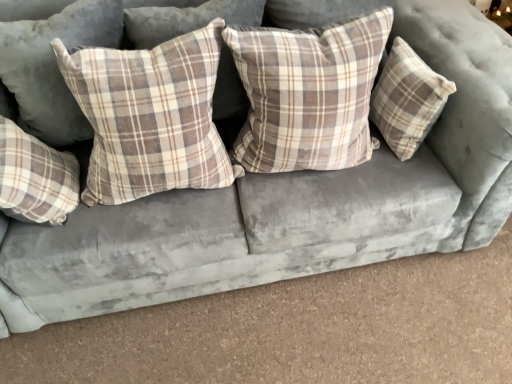
What do you see at coordinates (54, 66) in the screenshot? I see `plaid fabric pillow at upper left, the 1th pillow from the left` at bounding box center [54, 66].

What is the approximate height of plaid fabric pillow at center, the 3th pillow when ordered from left to right?

15.43 inches.

Describe the element at coordinates (35, 178) in the screenshot. This screenshot has height=384, width=512. I see `plaid fabric pillow at left, which is the 2th pillow in left-to-right order` at that location.

Identify the location of plaid fabric pillow at upper left, the 1th pillow from the left. (54, 66).

You are a GUI agent. You are given a task and a screenshot of the screen. Output one action in this format:
    pyautogui.click(x=<x>, y=<y>)
    Task: Click on the pillow that is the 1st one when counting downward from the plaid fabric pillow at center, acting as the 4th pillow starting from the left (from the image's perspective)
    The width and height of the screenshot is (512, 384).
    Given the screenshot: What is the action you would take?
    pyautogui.click(x=150, y=116)

From a real-world perspective, is plaid fabric pillow at center, acting as the 4th pillow starting from the left, above or below plaid fabric pillow at center, which is the 3th pillow from right to left?

In terms of real-world spatial position, plaid fabric pillow at center, acting as the 4th pillow starting from the left, is above plaid fabric pillow at center, which is the 3th pillow from right to left.

Consider the image. Is plaid fabric pillow at center, acting as the 4th pillow starting from the left, positioned with its back to plaid fabric pillow at center, the 3th pillow when ordered from left to right?

No, plaid fabric pillow at center, acting as the 4th pillow starting from the left, is not facing away from plaid fabric pillow at center, the 3th pillow when ordered from left to right.

Is plaid fabric pillow at center, arranged as the 2th pillow when viewed from the right, located outside plaid fabric pillow at center, which is the 3th pillow from right to left?

Yes.

Which point is more forward, (x=29, y=23) or (x=51, y=205)?

Positioned in front is point (x=51, y=205).

How many degrees apart are the facing directions of plaid fabric pillow at upper left, the fifth pillow when ordered from right to left, and plaid fabric pillow at left, which is the 2th pillow in left-to-right order?

The facing directions of plaid fabric pillow at upper left, the fifth pillow when ordered from right to left, and plaid fabric pillow at left, which is the 2th pillow in left-to-right order, are 90 degrees apart.

Which of these two, plaid fabric pillow at upper left, the 1th pillow from the left, or plaid fabric pillow at left, which is counted as the fourth pillow, starting from the right, is wider?

Wider between the two is plaid fabric pillow at upper left, the 1th pillow from the left.

In the image, is plaid fabric pillow at upper left, the 1th pillow from the left, positioned in front of or behind plaid fabric pillow at left, which is counted as the fourth pillow, starting from the right?

plaid fabric pillow at upper left, the 1th pillow from the left, is positioned farther from the viewer than plaid fabric pillow at left, which is counted as the fourth pillow, starting from the right.

Are plaid fabric pillow at center, which is the 3th pillow from right to left, and plaid fabric pillow at right, marked as the fifth pillow in a left-to-right arrangement, beside each other?

No, plaid fabric pillow at center, which is the 3th pillow from right to left, is not touching plaid fabric pillow at right, marked as the fifth pillow in a left-to-right arrangement.

Between point (141, 169) and point (408, 127), which one is positioned behind?

The point (408, 127) is more distant.

Is plaid fabric pillow at center, which is the 3th pillow from right to left, oriented away from plaid fabric pillow at right, marked as the first pillow in a right-to-left arrangement?

plaid fabric pillow at center, which is the 3th pillow from right to left, is not turned away from plaid fabric pillow at right, marked as the first pillow in a right-to-left arrangement.

Between plaid fabric pillow at center, the 3th pillow when ordered from left to right, and plaid fabric pillow at right, marked as the fifth pillow in a left-to-right arrangement, which one has more height?

Standing taller between the two is plaid fabric pillow at center, the 3th pillow when ordered from left to right.

Which object is thinner, plaid fabric pillow at right, marked as the fifth pillow in a left-to-right arrangement, or plaid fabric pillow at center, the 3th pillow when ordered from left to right?

Thinner between the two is plaid fabric pillow at right, marked as the fifth pillow in a left-to-right arrangement.

I want to click on the 2nd pillow below when counting from the plaid fabric pillow at right, marked as the first pillow in a right-to-left arrangement (from the image's perspective), so click(x=150, y=116).

From a real-world perspective, is plaid fabric pillow at right, marked as the first pillow in a right-to-left arrangement, physically below plaid fabric pillow at center, the 3th pillow when ordered from left to right?

Indeed, from a real-world perspective, plaid fabric pillow at right, marked as the first pillow in a right-to-left arrangement, is positioned beneath plaid fabric pillow at center, the 3th pillow when ordered from left to right.

Is plaid fabric pillow at center, acting as the 4th pillow starting from the left, a part of plaid fabric pillow at upper left, the fifth pillow when ordered from right to left?

No.

From a real-world perspective, is plaid fabric pillow at upper left, the 1th pillow from the left, physically located above or below plaid fabric pillow at center, arranged as the 2th pillow when viewed from the right?

plaid fabric pillow at upper left, the 1th pillow from the left, is situated higher than plaid fabric pillow at center, arranged as the 2th pillow when viewed from the right, in the real world.

How distant is plaid fabric pillow at left, which is counted as the fourth pillow, starting from the right, from plaid fabric pillow at center, the 3th pillow when ordered from left to right?

plaid fabric pillow at left, which is counted as the fourth pillow, starting from the right, is 10.67 inches away from plaid fabric pillow at center, the 3th pillow when ordered from left to right.

In terms of height, does plaid fabric pillow at left, which is counted as the fourth pillow, starting from the right, look taller or shorter compared to plaid fabric pillow at center, which is the 3th pillow from right to left?

In the image, plaid fabric pillow at left, which is counted as the fourth pillow, starting from the right, appears to be shorter than plaid fabric pillow at center, which is the 3th pillow from right to left.

Which of these two, plaid fabric pillow at left, which is counted as the fourth pillow, starting from the right, or plaid fabric pillow at center, the 3th pillow when ordered from left to right, is thinner?

plaid fabric pillow at left, which is counted as the fourth pillow, starting from the right, is thinner.

From the image's perspective, is plaid fabric pillow at left, which is counted as the fourth pillow, starting from the right, located beneath plaid fabric pillow at center, the 3th pillow when ordered from left to right?

Yes, from the image's perspective, plaid fabric pillow at left, which is counted as the fourth pillow, starting from the right, is beneath plaid fabric pillow at center, the 3th pillow when ordered from left to right.

Who is bigger, plaid fabric pillow at center, arranged as the 2th pillow when viewed from the right, or plaid fabric pillow at left, which is the 2th pillow in left-to-right order?

plaid fabric pillow at center, arranged as the 2th pillow when viewed from the right, is bigger.

Which object is closer to the camera, plaid fabric pillow at center, acting as the 4th pillow starting from the left, or plaid fabric pillow at left, which is counted as the fourth pillow, starting from the right?

plaid fabric pillow at center, acting as the 4th pillow starting from the left.

Is plaid fabric pillow at center, acting as the 4th pillow starting from the left, inside or outside of plaid fabric pillow at left, which is counted as the fourth pillow, starting from the right?

plaid fabric pillow at center, acting as the 4th pillow starting from the left, is located beyond the bounds of plaid fabric pillow at left, which is counted as the fourth pillow, starting from the right.

Locate an element on the screen. Image resolution: width=512 pixels, height=384 pixels. pillow that is the 1st object directly below the plaid fabric pillow at center, arranged as the 2th pillow when viewed from the right (from a real-world perspective) is located at coordinates (150, 116).

Where is `the 4th pillow directly above the plaid fabric pillow at left, which is the 2th pillow in left-to-right order (from a real-world perspective)`? the 4th pillow directly above the plaid fabric pillow at left, which is the 2th pillow in left-to-right order (from a real-world perspective) is located at coordinates (54, 66).

Which object lies nearer to the anchor point plaid fabric pillow at left, which is counted as the fourth pillow, starting from the right, plaid fabric pillow at right, marked as the first pillow in a right-to-left arrangement, or plaid fabric pillow at center, acting as the 4th pillow starting from the left?

plaid fabric pillow at center, acting as the 4th pillow starting from the left, lies closer to plaid fabric pillow at left, which is counted as the fourth pillow, starting from the right, than the other object.

Considering their positions, is plaid fabric pillow at right, marked as the first pillow in a right-to-left arrangement, positioned closer to plaid fabric pillow at center, which is the 3th pillow from right to left, than plaid fabric pillow at left, which is counted as the fourth pillow, starting from the right?

plaid fabric pillow at left, which is counted as the fourth pillow, starting from the right, lies closer to plaid fabric pillow at center, which is the 3th pillow from right to left, than the other object.

Based on their spatial positions, is plaid fabric pillow at center, which is the 3th pillow from right to left, or plaid fabric pillow at left, which is counted as the fourth pillow, starting from the right, closer to plaid fabric pillow at upper left, the fifth pillow when ordered from right to left?

plaid fabric pillow at left, which is counted as the fourth pillow, starting from the right, lies closer to plaid fabric pillow at upper left, the fifth pillow when ordered from right to left, than the other object.

Considering their positions, is plaid fabric pillow at center, which is the 3th pillow from right to left, positioned further to plaid fabric pillow at left, which is counted as the fourth pillow, starting from the right, than plaid fabric pillow at center, acting as the 4th pillow starting from the left?

Among the two, plaid fabric pillow at center, acting as the 4th pillow starting from the left, is located further to plaid fabric pillow at left, which is counted as the fourth pillow, starting from the right.

Based on their spatial positions, is plaid fabric pillow at upper left, the fifth pillow when ordered from right to left, or plaid fabric pillow at right, marked as the first pillow in a right-to-left arrangement, closer to plaid fabric pillow at center, the 3th pillow when ordered from left to right?

Among the two, plaid fabric pillow at upper left, the fifth pillow when ordered from right to left, is located nearer to plaid fabric pillow at center, the 3th pillow when ordered from left to right.

Based on their spatial positions, is plaid fabric pillow at center, acting as the 4th pillow starting from the left, or plaid fabric pillow at upper left, the fifth pillow when ordered from right to left, further from plaid fabric pillow at center, which is the 3th pillow from right to left?

plaid fabric pillow at center, acting as the 4th pillow starting from the left, lies further to plaid fabric pillow at center, which is the 3th pillow from right to left, than the other object.

From the image, which object appears to be farther from plaid fabric pillow at center, the 3th pillow when ordered from left to right, plaid fabric pillow at left, which is counted as the fourth pillow, starting from the right, or plaid fabric pillow at upper left, the 1th pillow from the left?

plaid fabric pillow at left, which is counted as the fourth pillow, starting from the right.

Based on their spatial positions, is plaid fabric pillow at right, marked as the first pillow in a right-to-left arrangement, or plaid fabric pillow at center, the 3th pillow when ordered from left to right, closer to plaid fabric pillow at upper left, the 1th pillow from the left?

plaid fabric pillow at center, the 3th pillow when ordered from left to right, is positioned closer to the anchor plaid fabric pillow at upper left, the 1th pillow from the left.

The width and height of the screenshot is (512, 384). What are the coordinates of `pillow between plaid fabric pillow at upper left, the 1th pillow from the left, and plaid fabric pillow at center, which is the 3th pillow from right to left, from left to right` in the screenshot? It's located at (35, 178).

Locate an element on the screen. pillow between plaid fabric pillow at center, which is the 3th pillow from right to left, and plaid fabric pillow at right, marked as the first pillow in a right-to-left arrangement, in the horizontal direction is located at coordinates (308, 93).

Locate an element on the screen. This screenshot has height=384, width=512. pillow situated between plaid fabric pillow at left, which is counted as the fourth pillow, starting from the right, and plaid fabric pillow at center, acting as the 4th pillow starting from the left, from left to right is located at coordinates (150, 116).